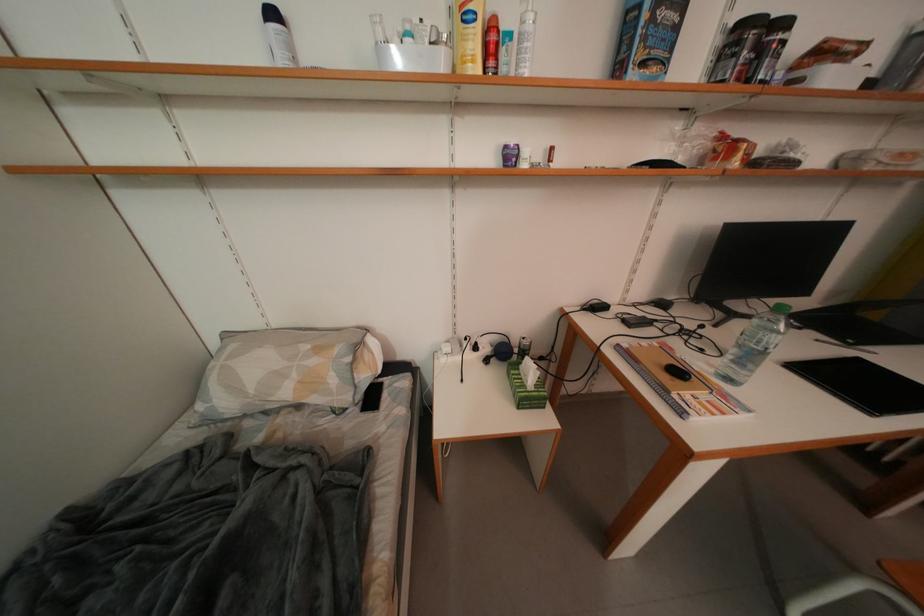
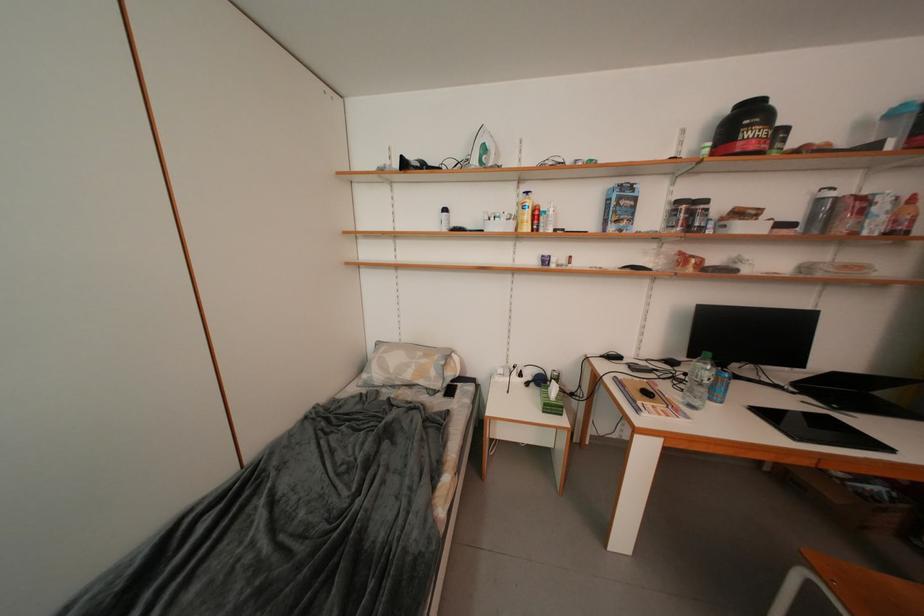
Question: The first image is from the beginning of the video and the second image is from the end. How did the camera likely rotate when shooting the video?

Choices:
 (A) Left
 (B) Right
 (C) Up
 (D) Down

Answer: (A)